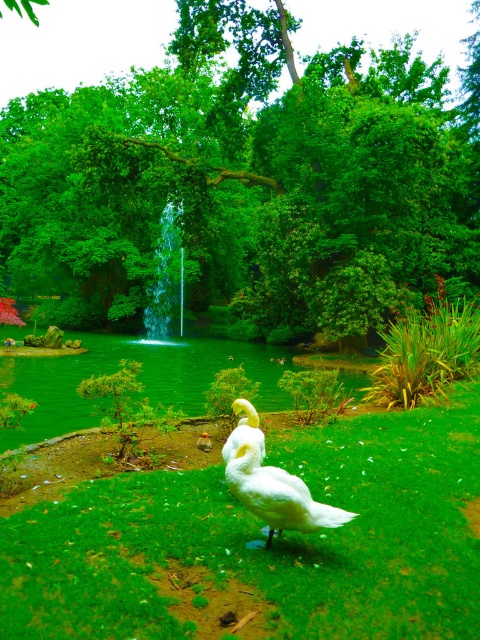
You are standing in the garden and want to reach the point marked as point [225,113]. If your walking speed is 1.5 meters per second, how long will it take you to reach the point?

The point [225,113] is 26.35 meters away from the viewer. At a walking speed of 1.5 meters per second, it will take approximately 17.57 seconds to reach the point.

You are a bird flying over the garden and want to land on the tallest object between the green leafy tree at center and the green glossy pond at center. Which object should you choose?

The green leafy tree at center is taller than the green glossy pond at center, so you should land on the green leafy tree at center.

You are a gardener who wants to place a new decorative statue in the garden. The statue is 1.2 meters wide. You see the green glossy pond at center and the white matte duck at center. Can you place the statue between them without overlapping either?

The green glossy pond at center is larger in size than the white matte duck at center, but the exact distance between them isn not specified. Without knowing the spacing between the two objects, it is impossible to determine if the statue will fit.